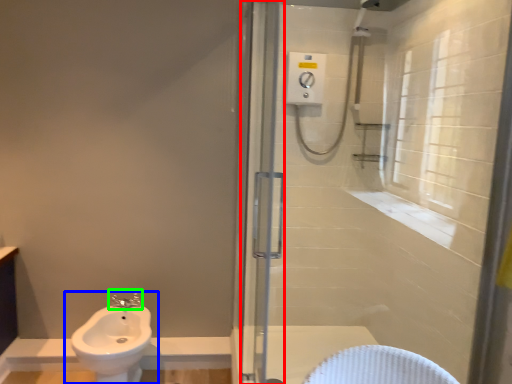
Question: Considering the real-world distances, which object is closest to screen door (highlighted by a red box)? sink (highlighted by a blue box) or tap (highlighted by a green box).

Choices:
 (A) sink
 (B) tap

Answer: (A)